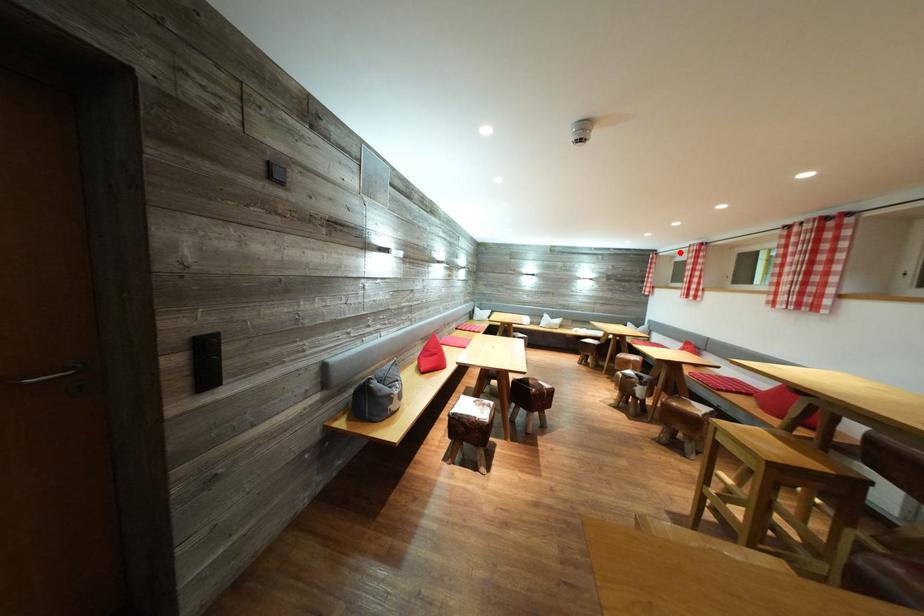
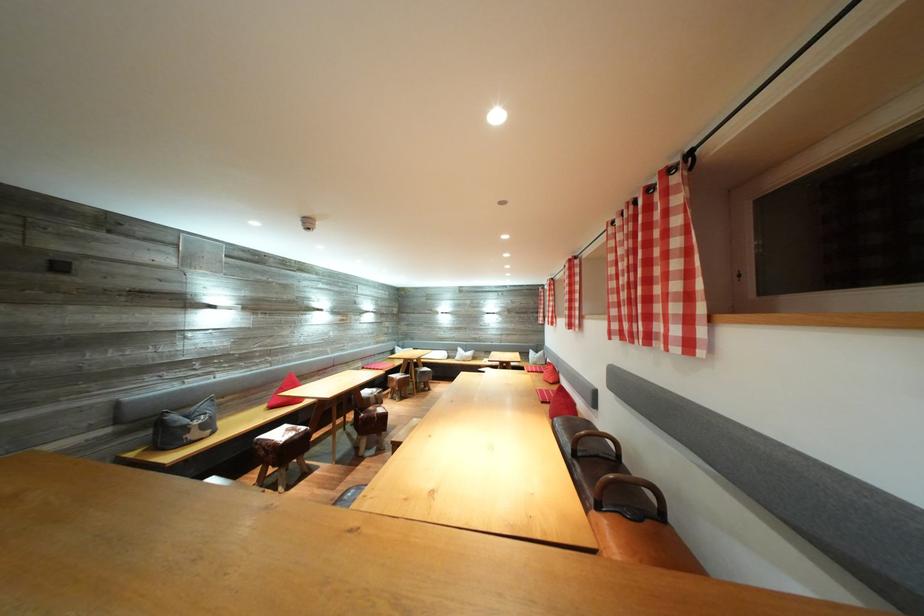
The point at the highlighted location is marked in the first image. Where is the corresponding point in the second image?

(553, 288)